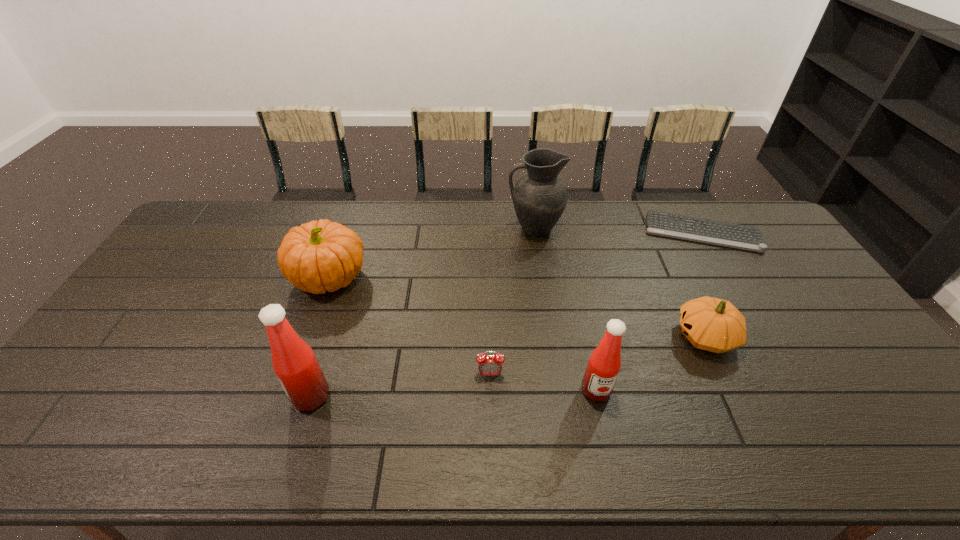
Locate an element on the screen. This screenshot has height=540, width=960. free space between the taller condiment and the computer keyboard is located at coordinates (507, 314).

Locate an element on the screen. This screenshot has width=960, height=540. the closest object to the fifth shortest object is located at coordinates (489, 365).

Locate an element on the screen. the closest object to the pitcher is located at coordinates (744, 237).

At what (x,y) coordinates should I click in order to perform the action: click on vacant region that satisfies the following two spatial constraints: 1. on the side of the pitcher with the handle; 2. on the face of the alarm clock. Please return your answer as a coordinate pair (x, y). The image size is (960, 540). Looking at the image, I should click on (555, 374).

This screenshot has width=960, height=540. I want to click on free space that satisfies the following two spatial constraints: 1. on the front side of the computer keyboard; 2. on the surface of the pumpkin, so click(729, 278).